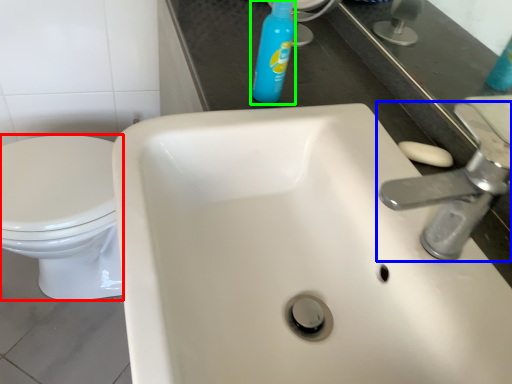
Question: Considering the real-world distances, which object is closest to bidet (highlighted by a red box)? tap (highlighted by a blue box) or cleaning product (highlighted by a green box).

Choices:
 (A) tap
 (B) cleaning product

Answer: (B)